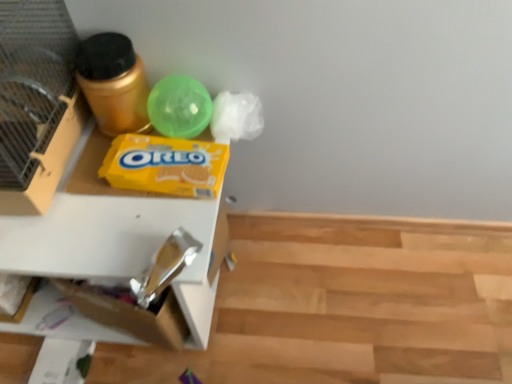
You are a GUI agent. You are given a task and a screenshot of the screen. Output one action in this format:
    pyautogui.click(x=<x>, y=<y>)
    Task: Click on the vacant area situated to the left side of translucent green ball at upper center
    
    Given the screenshot: What is the action you would take?
    pyautogui.click(x=101, y=153)